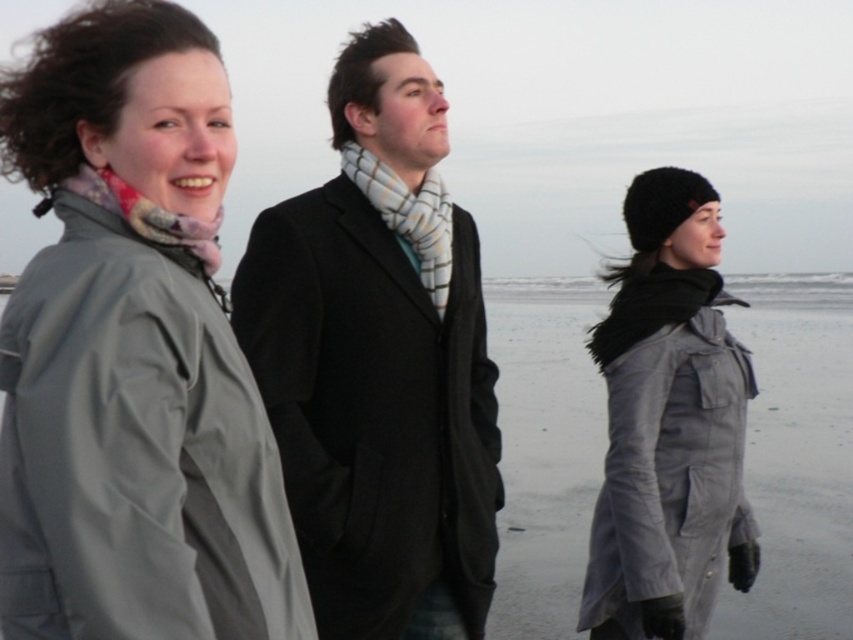
In the scene shown: Is matte gray coat at left bigger than black wool coat at center?

Actually, matte gray coat at left might be smaller than black wool coat at center.

Does point (154, 508) come closer to viewer compared to point (476, 451)?

Yes, point (154, 508) is closer to viewer.

Locate an element on the screen. matte gray coat at left is located at coordinates (132, 355).

Does matte gray coat at left have a greater height compared to matte gray coat at center?

In fact, matte gray coat at left may be shorter than matte gray coat at center.

Which is above, matte gray coat at left or matte gray coat at center?

matte gray coat at left is higher up.

What are the coordinates of `matte gray coat at left` in the screenshot? It's located at (132, 355).

Which is more to the right, black wool coat at center or matte gray coat at center?

matte gray coat at center is more to the right.

Is black wool coat at center shorter than matte gray coat at center?

Incorrect, black wool coat at center's height does not fall short of matte gray coat at center's.

Identify the location of black wool coat at center. This screenshot has height=640, width=853. (379, 364).